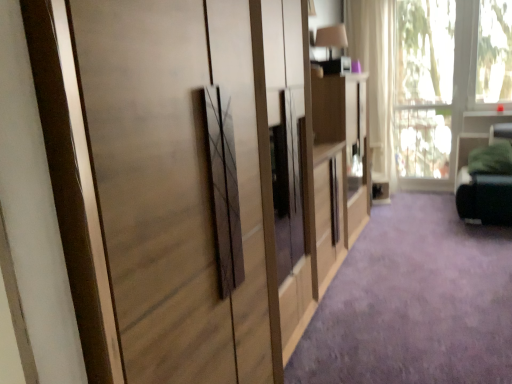
What is the approximate width of purple carpet at center?

3.88 meters.

Measure the distance between point (x=425, y=58) and camera.

5.23 meters.

Locate an element on the screen. white sheer curtain at upper right is located at coordinates (375, 78).

At what (x,y) coordinates should I click in order to perform the action: click on dresser lying on the right of matte wood cupboard at center. Please return your answer as a coordinate pair (x, y). The width and height of the screenshot is (512, 384). Looking at the image, I should click on tap(339, 164).

Which point is more distant from viewer, [351,202] or [279,8]?

Positioned behind is point [351,202].

Is matte wood dresser at center turned away from matte wood cupboard at center?

That's not correct — matte wood dresser at center is not looking away from matte wood cupboard at center.

From a real-world perspective, is purple carpet at center located higher than matte wood dresser at center?

Incorrect, from a real-world perspective, purple carpet at center is lower than matte wood dresser at center.

Is purple carpet at center looking in the opposite direction of matte wood dresser at center?

No, purple carpet at center's orientation is not away from matte wood dresser at center.

Can you tell me how much purple carpet at center and matte wood dresser at center differ in facing direction?

The angular difference between purple carpet at center and matte wood dresser at center is 90.2 degrees.

Consider the image. Is purple carpet at center positioned far away from matte wood dresser at center?

No, purple carpet at center is not far from matte wood dresser at center.

Considering the positions of objects matte wood cupboard at center and purple carpet at center in the image provided, who is more to the left, matte wood cupboard at center or purple carpet at center?

Positioned to the left is matte wood cupboard at center.

Is point (146, 209) more distant than point (434, 381)?

That is False.

How far apart are matte wood cupboard at center and purple carpet at center?

matte wood cupboard at center and purple carpet at center are 1.32 meters apart.

Which of these two, matte wood cupboard at center or purple carpet at center, stands taller?

matte wood cupboard at center is taller.

Considering the sizes of objects white sheer curtain at upper right and purple carpet at center in the image provided, who is bigger, white sheer curtain at upper right or purple carpet at center?

white sheer curtain at upper right is bigger.

Does point (354, 12) come farther from viewer compared to point (434, 337)?

Yes, it is behind point (434, 337).

Is the surface of white sheer curtain at upper right in direct contact with purple carpet at center?

white sheer curtain at upper right and purple carpet at center are not in contact.

From the image's perspective, which is above, white sheer curtain at upper right or purple carpet at center?

white sheer curtain at upper right.

Could you tell me if transparent glass window at upper right is facing matte wood dresser at center?

Yes, transparent glass window at upper right faces towards matte wood dresser at center.

Is matte wood dresser at center inside transparent glass window at upper right?

Actually, matte wood dresser at center is outside transparent glass window at upper right.

From a real-world perspective, is transparent glass window at upper right positioned under matte wood dresser at center based on gravity?

No, from a real-world perspective, transparent glass window at upper right is not beneath matte wood dresser at center.

Which of these two, transparent glass window at upper right or matte wood dresser at center, stands taller?

Standing taller between the two is transparent glass window at upper right.

Where is `plain located in front of the white sheer curtain at upper right`? The height and width of the screenshot is (384, 512). plain located in front of the white sheer curtain at upper right is located at coordinates (414, 302).

From a real-world perspective, does purple carpet at center sit lower than white sheer curtain at upper right?

Indeed, from a real-world perspective, purple carpet at center is positioned beneath white sheer curtain at upper right.

In terms of size, does purple carpet at center appear bigger or smaller than white sheer curtain at upper right?

Considering their sizes, purple carpet at center takes up less space than white sheer curtain at upper right.

From the image's perspective, is purple carpet at center positioned above or below white sheer curtain at upper right?

purple carpet at center is situated lower than white sheer curtain at upper right in the image.

Which is farther, (451, 361) or (244, 27)?

Answer: Positioned behind is point (451, 361).

Which object is positioned more to the left, purple carpet at center or matte wood cupboard at center?

From the viewer's perspective, matte wood cupboard at center appears more on the left side.

Can you confirm if purple carpet at center is wider than matte wood cupboard at center?

Yes, purple carpet at center is wider than matte wood cupboard at center.

Identify the location of dresser that appears below the matte wood cupboard at center (from a real-world perspective). (339, 164).

The width and height of the screenshot is (512, 384). Find the location of `plain in front of the matte wood dresser at center`. plain in front of the matte wood dresser at center is located at coordinates tap(414, 302).

From the picture: Considering their positions, is white sheer curtain at upper right positioned further to transparent glass window at upper right than purple carpet at center?

purple carpet at center.

Which object lies further to the anchor point purple carpet at center, white sheer curtain at upper right or matte wood dresser at center?

Among the two, white sheer curtain at upper right is located further to purple carpet at center.

Based on the photo, when comparing their distances from white sheer curtain at upper right, does transparent glass window at upper right or purple carpet at center seem closer?

transparent glass window at upper right is closer to white sheer curtain at upper right.

From the image, which object appears to be farther from matte wood cupboard at center, white sheer curtain at upper right or matte wood dresser at center?

white sheer curtain at upper right is positioned further to the anchor matte wood cupboard at center.

Based on their spatial positions, is purple carpet at center or matte wood dresser at center closer to white sheer curtain at upper right?

matte wood dresser at center lies closer to white sheer curtain at upper right than the other object.

Considering their positions, is transparent glass window at upper right positioned closer to matte wood dresser at center than matte wood cupboard at center?

The object closer to matte wood dresser at center is matte wood cupboard at center.

Estimate the real-world distances between objects in this image. Which object is further from white sheer curtain at upper right, transparent glass window at upper right or matte wood dresser at center?

Among the two, matte wood dresser at center is located further to white sheer curtain at upper right.

When comparing their distances from purple carpet at center, does matte wood cupboard at center or transparent glass window at upper right seem closer?

matte wood cupboard at center is closer to purple carpet at center.

I want to click on window between matte wood cupboard at center and white sheer curtain at upper right from front to back, so click(x=446, y=78).

Identify the location of plain between matte wood cupboard at center and transparent glass window at upper right along the z-axis. The image size is (512, 384). (414, 302).

At what (x,y) coordinates should I click in order to perform the action: click on dresser between matte wood cupboard at center and white sheer curtain at upper right along the z-axis. Please return your answer as a coordinate pair (x, y). The image size is (512, 384). Looking at the image, I should click on (339, 164).

Where is `dresser positioned between purple carpet at center and white sheer curtain at upper right from near to far`? dresser positioned between purple carpet at center and white sheer curtain at upper right from near to far is located at coordinates (339, 164).